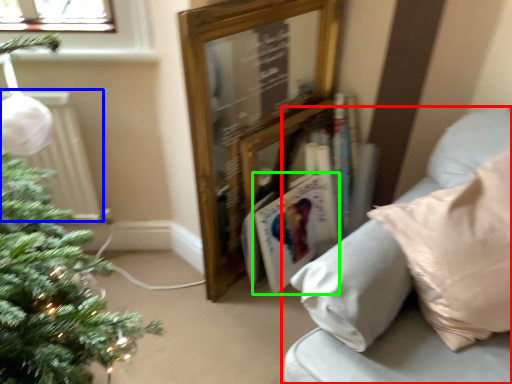
Question: Estimate the real-world distances between objects in this image. Which object is farther from studio couch (highlighted by a red box), radiator (highlighted by a blue box) or magazine (highlighted by a green box)?

Choices:
 (A) radiator
 (B) magazine

Answer: (A)